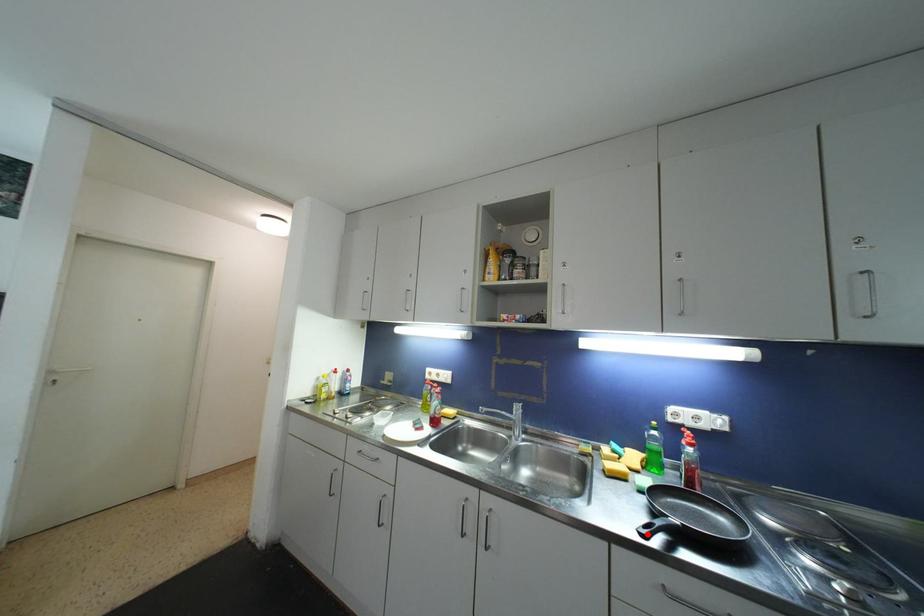
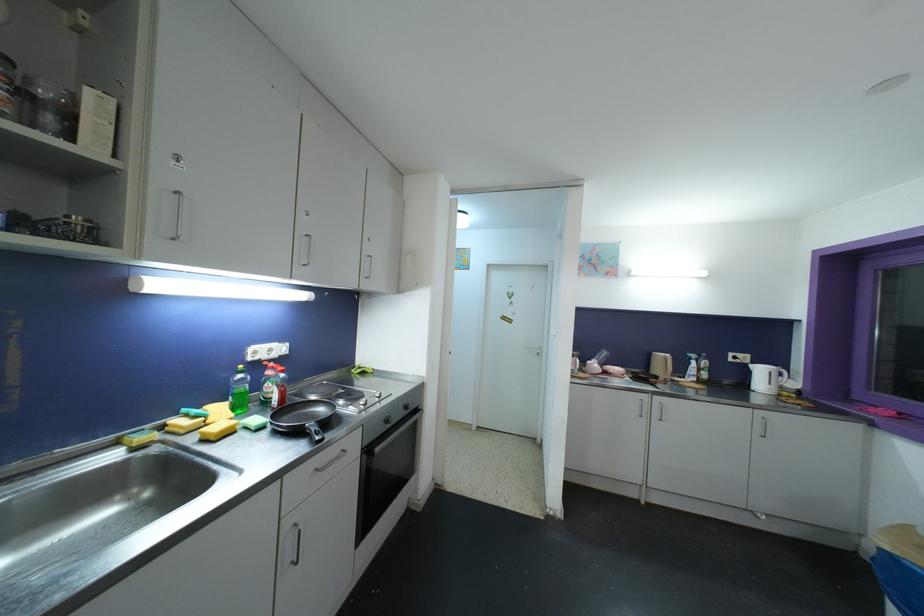
In the second image, find the point that corresponds to the highlighted location in the first image.

(321, 440)